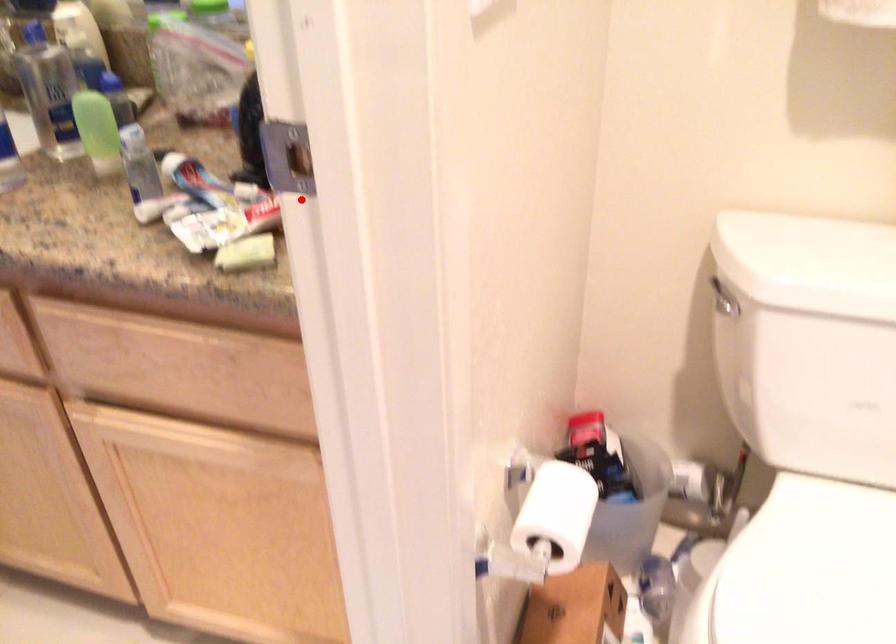
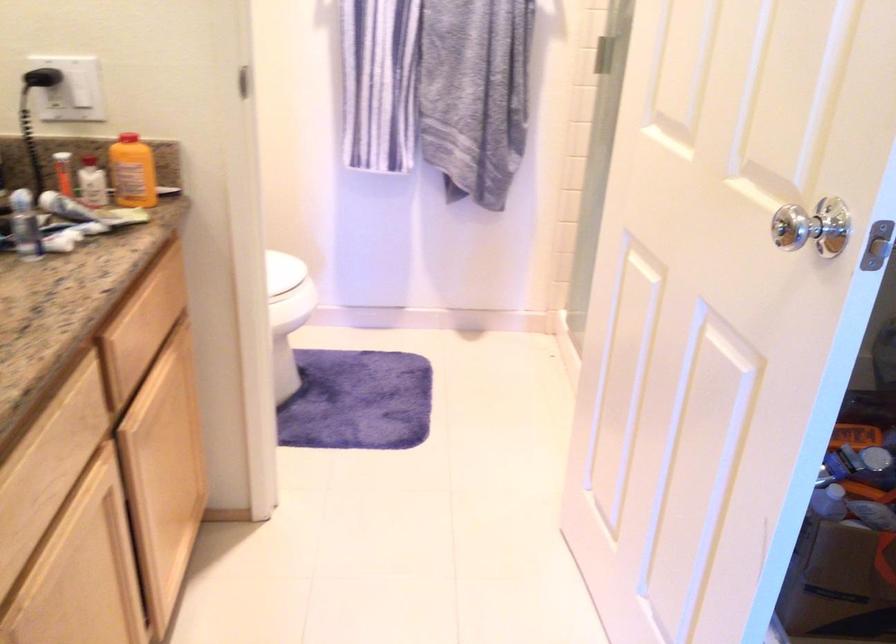
Question: I am providing you with two images of the same scene from different viewpoints. A red point is shown in image1. For the corresponding object point in image2, is it positioned nearer or farther from the camera?

Choices:
 (A) Nearer
 (B) Farther

Answer: (B)